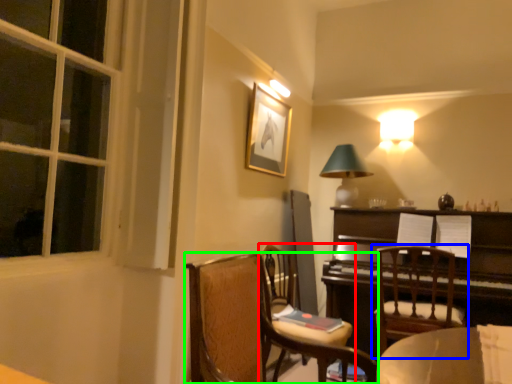
Question: Which is farther away from chair (highlighted by a red box)? chair (highlighted by a blue box) or chair (highlighted by a green box)?

Choices:
 (A) chair
 (B) chair

Answer: (A)